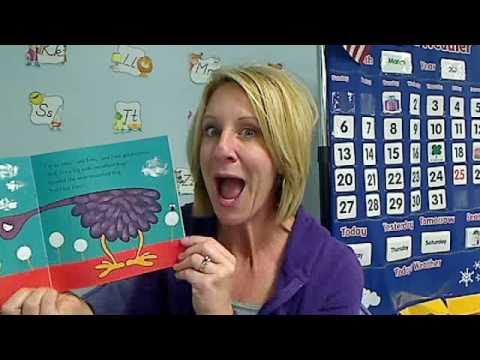
You are a GUI agent. You are given a task and a screenshot of the screen. Output one action in this format:
    pyautogui.click(x=<x>, y=<y>)
    Task: Click on the wall calendar
    
    Given the screenshot: What is the action you would take?
    pyautogui.click(x=460, y=195)